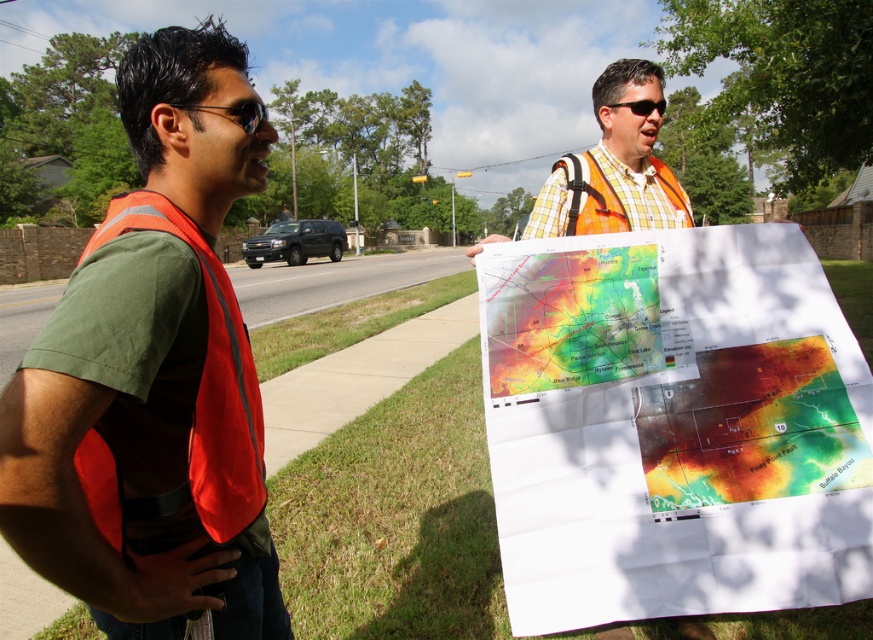
Looking at this image, which of these two, reflective orange vest at left or matte black goggles at upper left, stands shorter?

Standing shorter between the two is matte black goggles at upper left.

You are a GUI agent. You are given a task and a screenshot of the screen. Output one action in this format:
    pyautogui.click(x=<x>, y=<y>)
    Task: Click on the reflective orange vest at left
    
    Given the screenshot: What is the action you would take?
    pyautogui.click(x=146, y=371)

This screenshot has width=873, height=640. I want to click on reflective orange vest at left, so click(146, 371).

In the scene shown: Can you confirm if orange reflective safety vest at center is positioned above black plastic goggles at upper center?

Incorrect, orange reflective safety vest at center is not positioned above black plastic goggles at upper center.

The width and height of the screenshot is (873, 640). What do you see at coordinates (607, 196) in the screenshot?
I see `orange reflective safety vest at center` at bounding box center [607, 196].

Is point (538, 236) positioned before point (636, 108)?

Yes, point (538, 236) is in front of point (636, 108).

I want to click on orange reflective safety vest at center, so click(x=607, y=196).

Does reflective orange vest at left have a smaller size compared to black plastic goggles at upper center?

No, reflective orange vest at left is not smaller than black plastic goggles at upper center.

Does reflective orange vest at left appear over black plastic goggles at upper center?

No.

Describe the element at coordinates (146, 371) in the screenshot. The image size is (873, 640). I see `reflective orange vest at left` at that location.

Where is `reflective orange vest at left`? The width and height of the screenshot is (873, 640). reflective orange vest at left is located at coordinates (146, 371).